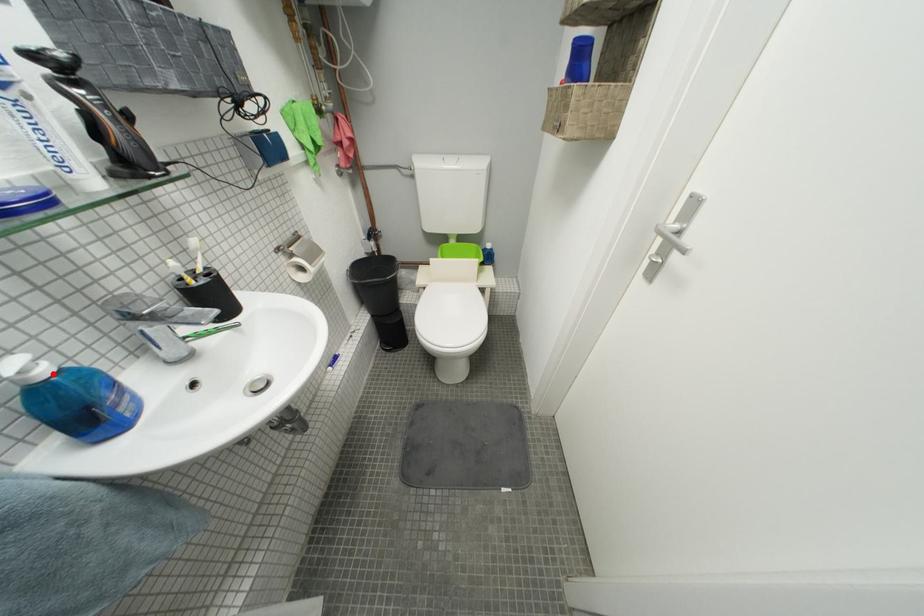
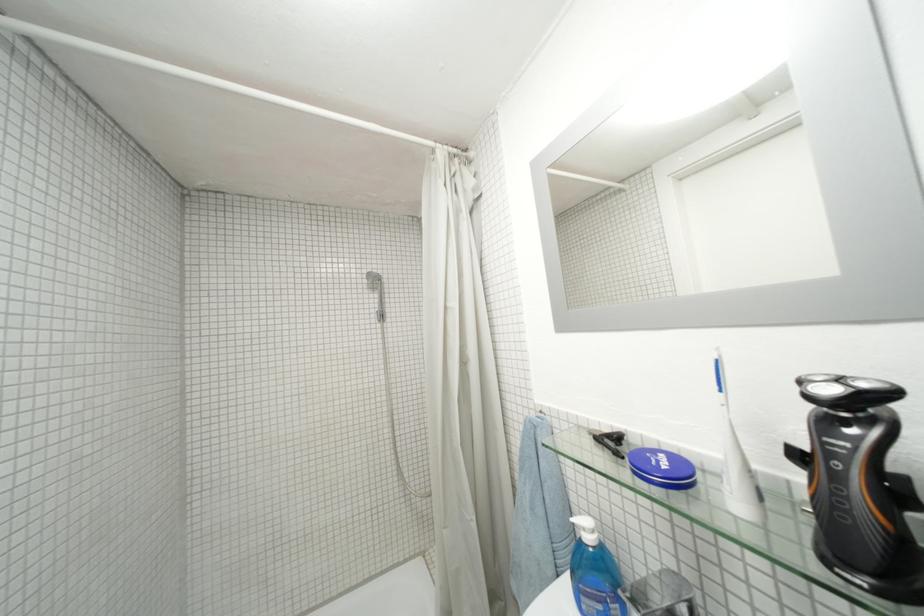
In the second image, find the point that corresponds to the highlighted location in the first image.

(598, 541)